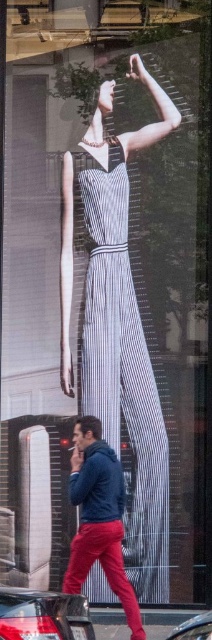
Question: Considering the relative positions of white striped jumpsuit at center and matte blue hoodie at center in the image provided, where is white striped jumpsuit at center located with respect to matte blue hoodie at center?

Choices:
 (A) left
 (B) right

Answer: (B)

Question: Does white striped jumpsuit at center appear on the right side of shiny black car at lower left?

Choices:
 (A) yes
 (B) no

Answer: (A)

Question: Can you confirm if matte blue hoodie at center is wider than metallic silver car at lower center?

Choices:
 (A) no
 (B) yes

Answer: (B)

Question: Which point is farther to the camera?

Choices:
 (A) (126, 577)
 (B) (108, 284)
 (C) (47, 616)
 (D) (199, 616)

Answer: (B)

Question: Which object is closer to the camera taking this photo?

Choices:
 (A) metallic silver car at lower center
 (B) matte blue hoodie at center
 (C) white striped jumpsuit at center
 (D) shiny black car at lower left

Answer: (D)

Question: Which point is farther from the camera taking this photo?

Choices:
 (A) (4, 624)
 (B) (110, 225)
 (C) (104, 536)

Answer: (B)